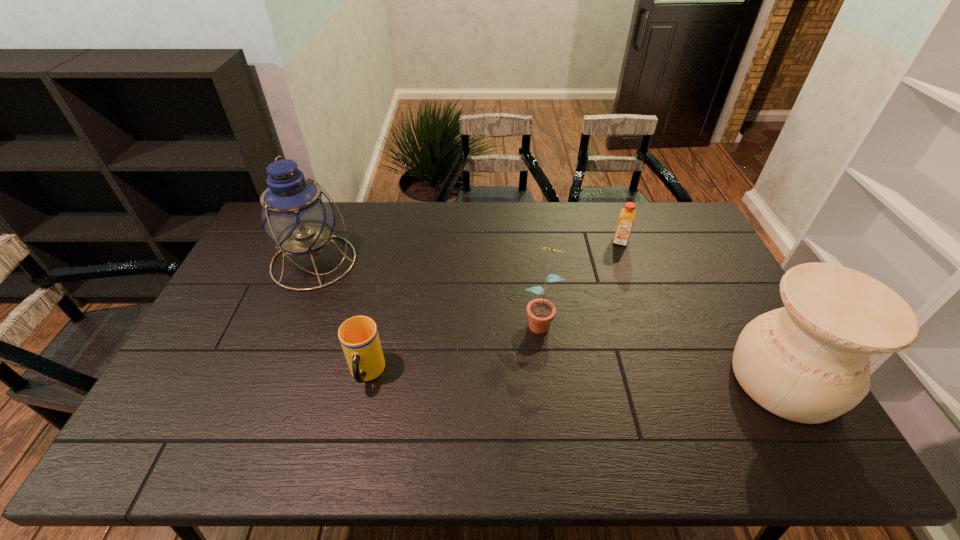
This screenshot has width=960, height=540. Find the location of `the fourth closest object relative to the third object from right to left`. the fourth closest object relative to the third object from right to left is located at coordinates (296, 214).

Point out which object is positioned as the second nearest to the fourth object from left to right. Please provide its 2D coordinates. Your answer should be formatted as a tuple, i.e. [(x, y)], where the tuple contains the x and y coordinates of a point satisfying the conditions above.

[(809, 362)]

Identify the location of free space that satisfies the following two spatial constraints: 1. on the front side of the sunflower; 2. at the open side of the pottery. This screenshot has height=540, width=960. (548, 380).

Locate an element on the screen. free spot that satisfies the following two spatial constraints: 1. on the side of the pottery with the handle; 2. at the open side of the cup is located at coordinates (366, 380).

Find the location of `blank area in the image that satisfies the following two spatial constraints: 1. on the side of the pottery with the handle; 2. at the open side of the fourth object from right to left`. blank area in the image that satisfies the following two spatial constraints: 1. on the side of the pottery with the handle; 2. at the open side of the fourth object from right to left is located at coordinates (366, 380).